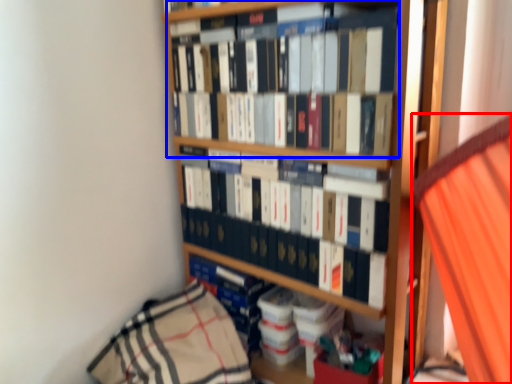
Question: Which object appears closest to the camera in this image, curtain (highlighted by a red box) or book (highlighted by a blue box)?

Choices:
 (A) curtain
 (B) book

Answer: (A)